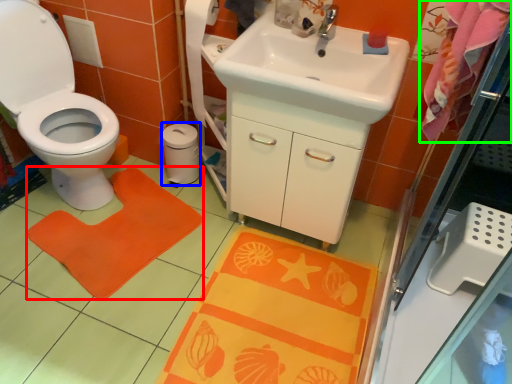
Question: Which object is the closest to the doormat (highlighted by a red box)? Choose among these: toilet paper (highlighted by a blue box) or beach towel (highlighted by a green box).

Choices:
 (A) toilet paper
 (B) beach towel

Answer: (A)